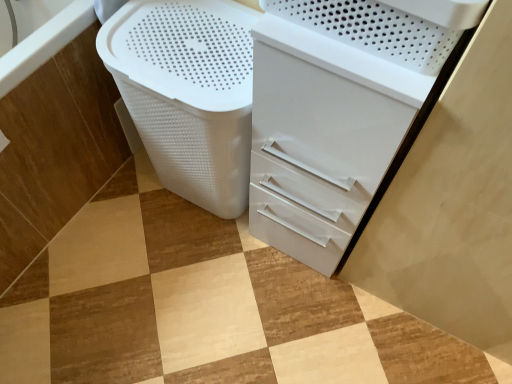
You are a GUI agent. You are given a task and a screenshot of the screen. Output one action in this format:
    pyautogui.click(x=<x>, y=<y>)
    Task: Click on the white glossy file cabinet at center
    This screenshot has height=384, width=512.
    Given the screenshot: What is the action you would take?
    [341, 111]

Describe the element at coordinates (188, 93) in the screenshot. I see `white plastic laundry basket at lower left` at that location.

Locate an element on the screen. This screenshot has width=512, height=384. white plastic basket at lower left is located at coordinates (53, 134).

How distant is white plastic laundry basket at lower left from white plastic basket at lower left?

The distance of white plastic laundry basket at lower left from white plastic basket at lower left is 30.55 centimeters.

Find the location of a particular element. bath in front of the white plastic laundry basket at lower left is located at coordinates (53, 134).

Which of these two, white plastic laundry basket at lower left or white plastic basket at lower left, stands shorter?

white plastic laundry basket at lower left is shorter.

Does point (178, 71) come farther from viewer compared to point (44, 206)?

No, (178, 71) is closer to viewer.

Does point (138, 51) come behind point (384, 181)?

That is True.

Consider the image. Is white plastic laundry basket at lower left situated inside white glossy file cabinet at center or outside?

white plastic laundry basket at lower left is not inside white glossy file cabinet at center, it's outside.

Considering the sizes of white plastic laundry basket at lower left and white glossy file cabinet at center in the image, is white plastic laundry basket at lower left wider or thinner than white glossy file cabinet at center?

Considering their sizes, white plastic laundry basket at lower left looks broader than white glossy file cabinet at center.

From the image's perspective, which is above, white plastic laundry basket at lower left or white glossy file cabinet at center?

white plastic laundry basket at lower left is shown above in the image.

Which is more to the right, white glossy file cabinet at center or white plastic laundry basket at lower left?

From the viewer's perspective, white glossy file cabinet at center appears more on the right side.

Is white glossy file cabinet at center not inside white plastic laundry basket at lower left?

Yes, white glossy file cabinet at center is not within white plastic laundry basket at lower left.

From the image's perspective, is white glossy file cabinet at center above or below white plastic laundry basket at lower left?

Based on their image positions, white glossy file cabinet at center is located beneath white plastic laundry basket at lower left.

From a real-world perspective, is white glossy file cabinet at center above or below white plastic laundry basket at lower left?

white glossy file cabinet at center is situated higher than white plastic laundry basket at lower left in the real world.

Is white glossy file cabinet at center inside the boundaries of white plastic basket at lower left, or outside?

white glossy file cabinet at center is not inside white plastic basket at lower left, it's outside.

Does white glossy file cabinet at center turn towards white plastic basket at lower left?

No, white glossy file cabinet at center does not turn towards white plastic basket at lower left.

Which is in front, point (353, 130) or point (115, 162)?

The point (353, 130) is closer.

Is white glossy file cabinet at center at the back of white plastic basket at lower left?

white plastic basket at lower left is not turned away from white glossy file cabinet at center.

In terms of width, does white plastic basket at lower left look wider or thinner when compared to white glossy file cabinet at center?

white plastic basket at lower left is thinner than white glossy file cabinet at center.

Would you say white plastic basket at lower left is a long distance from white glossy file cabinet at center?

No, white plastic basket at lower left is not far away from white glossy file cabinet at center.

Is white plastic basket at lower left bigger than white plastic laundry basket at lower left?

Actually, white plastic basket at lower left might be smaller than white plastic laundry basket at lower left.

From a real-world perspective, is white plastic basket at lower left positioned under white plastic laundry basket at lower left based on gravity?

Yes, from a real-world perspective, white plastic basket at lower left is below white plastic laundry basket at lower left.

Looking at this image, is white plastic basket at lower left further to the viewer compared to white plastic laundry basket at lower left?

That is False.

At what (x,y) coordinates should I click in order to perform the action: click on laundry basket located on the right of white plastic basket at lower left. Please return your answer as a coordinate pair (x, y). The image size is (512, 384). Looking at the image, I should click on (188, 93).

You are a GUI agent. You are given a task and a screenshot of the screen. Output one action in this format:
    pyautogui.click(x=<x>, y=<y>)
    Task: Click on the bath on the left of the white plastic laundry basket at lower left
    The height and width of the screenshot is (384, 512).
    Given the screenshot: What is the action you would take?
    pyautogui.click(x=53, y=134)

At what (x,y) coordinates should I click in order to perform the action: click on laundry basket below the white glossy file cabinet at center (from a real-world perspective). Please return your answer as a coordinate pair (x, y). This screenshot has height=384, width=512. Looking at the image, I should click on (188, 93).

Estimate the real-world distances between objects in this image. Which object is closer to white plastic basket at lower left, white glossy file cabinet at center or white plastic laundry basket at lower left?

white plastic laundry basket at lower left is closer to white plastic basket at lower left.

When comparing their distances from white plastic laundry basket at lower left, does white plastic basket at lower left or white glossy file cabinet at center seem further?

white plastic basket at lower left is positioned further to the anchor white plastic laundry basket at lower left.

When comparing their distances from white plastic basket at lower left, does white plastic laundry basket at lower left or white glossy file cabinet at center seem further?

Based on the image, white glossy file cabinet at center appears to be further to white plastic basket at lower left.

Estimate the real-world distances between objects in this image. Which object is further from white glossy file cabinet at center, white plastic laundry basket at lower left or white plastic basket at lower left?

white plastic basket at lower left.

Which object lies nearer to the anchor point white plastic laundry basket at lower left, white glossy file cabinet at center or white plastic basket at lower left?

The object closer to white plastic laundry basket at lower left is white glossy file cabinet at center.

Looking at the image, which one is located further to white glossy file cabinet at center, white plastic basket at lower left or white plastic laundry basket at lower left?

white plastic basket at lower left.

You are a GUI agent. You are given a task and a screenshot of the screen. Output one action in this format:
    pyautogui.click(x=<x>, y=<y>)
    Task: Click on the laundry basket between white plastic basket at lower left and white glossy file cabinet at center in the horizontal direction
    
    Given the screenshot: What is the action you would take?
    pyautogui.click(x=188, y=93)